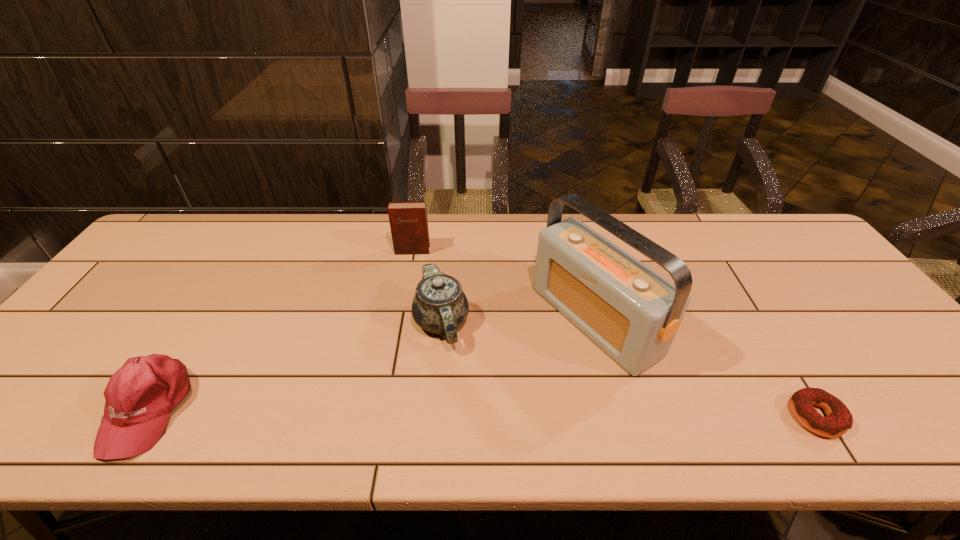
This screenshot has width=960, height=540. Identify the location of free spot on the desktop that is between the leftmost object and the rightmost object and is positioned on the front cover of the diary. (393, 411).

You are a GUI agent. You are given a task and a screenshot of the screen. Output one action in this format:
    pyautogui.click(x=<x>, y=<y>)
    Task: Click on the free spot on the desktop that is between the baseball cap and the shortest object and is positioned on the front-facing side of the fourth object from left to right
    This screenshot has height=540, width=960.
    Given the screenshot: What is the action you would take?
    coord(437,412)

You are a GUI agent. You are given a task and a screenshot of the screen. Output one action in this format:
    pyautogui.click(x=<x>, y=<y>)
    Task: Click on the vacant spot on the desktop that is between the leftmost object and the doughnut and is positioned from the spout of the chinaware
    The height and width of the screenshot is (540, 960).
    Given the screenshot: What is the action you would take?
    pyautogui.click(x=430, y=412)